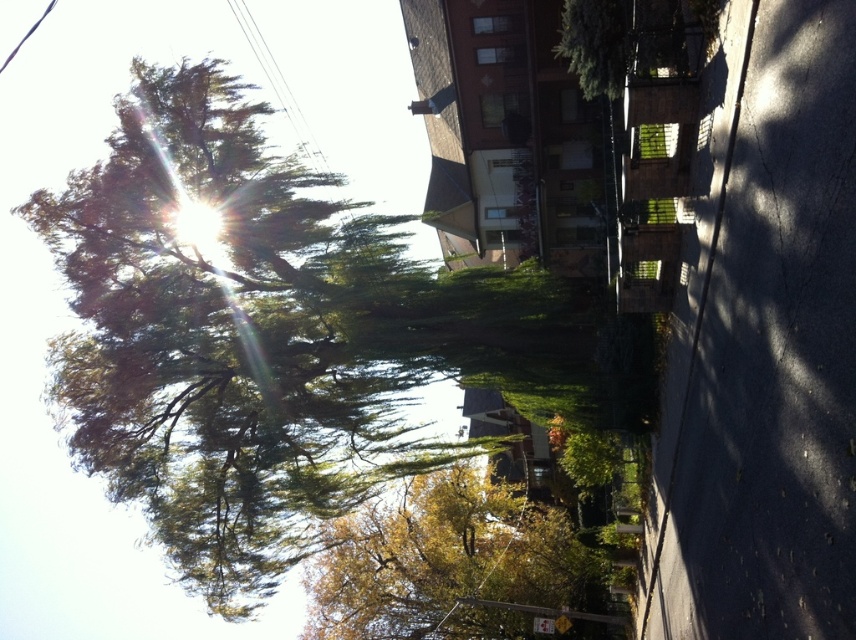
Question: Estimate the real-world distances between objects in this image. Which object is farther from the dark asphalt road at center?

Choices:
 (A) yellow-green leaves at center
 (B) green leafy tree at upper left

Answer: (A)

Question: Among these objects, which one is nearest to the camera?

Choices:
 (A) green leafy tree at upper left
 (B) yellow-green leaves at center
 (C) dark asphalt road at center

Answer: (C)

Question: Observing the image, what is the correct spatial positioning of green leafy tree at upper left in reference to yellow-green leaves at center?

Choices:
 (A) left
 (B) right

Answer: (A)

Question: Which point is farther to the camera?

Choices:
 (A) (501, 545)
 (B) (100, 317)

Answer: (A)

Question: Where is green leafy tree at upper left located in relation to yellow-green leaves at center in the image?

Choices:
 (A) left
 (B) right

Answer: (A)

Question: Is green leafy tree at upper left thinner than dark asphalt road at center?

Choices:
 (A) yes
 (B) no

Answer: (B)